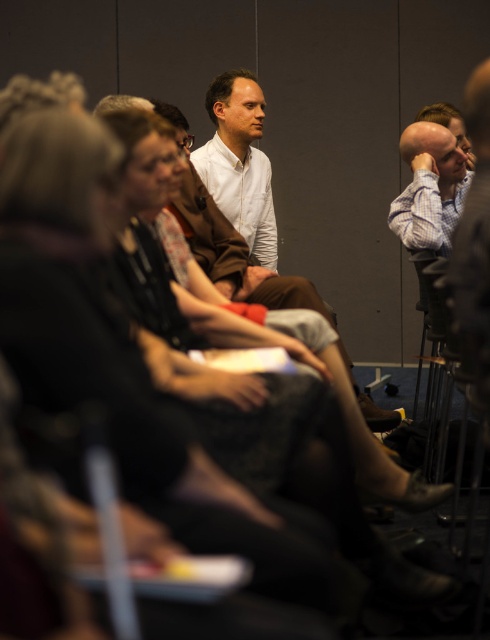
Who is more distant from viewer, (225, 90) or (424, 172)?

Point (225, 90)

Does white shirt at center have a greater width compared to light blue shirt at right?

No.

Measure the distance between point (x=262, y=248) and camera.

The distance of point (x=262, y=248) from camera is 15.00 feet.

Locate an element on the screen. white shirt at center is located at coordinates (243, 202).